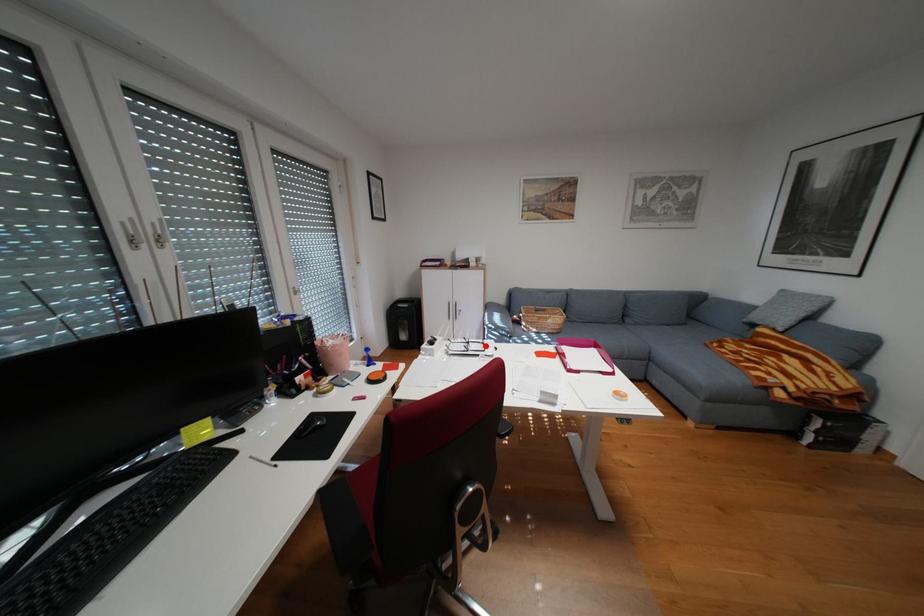
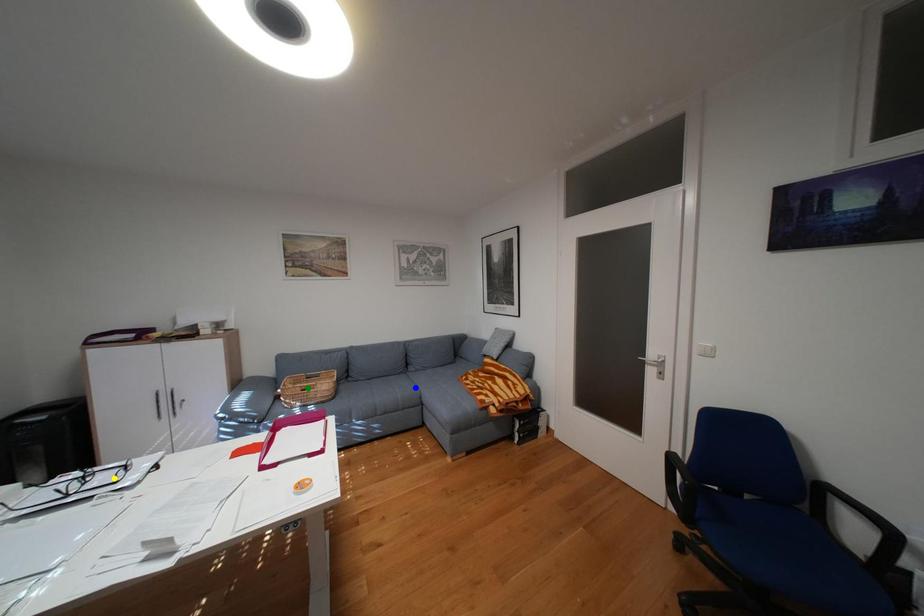
Question: I am providing you with two images of the same scene from different viewpoints. A red point is marked on the first image. You are given multiple points on the second image. Which spot in image 2 lines up with the point in image 1?

Choices:
 (A) green point
 (B) yellow point
 (C) blue point

Answer: (B)